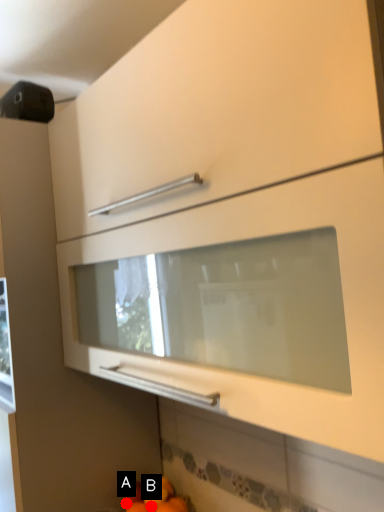
Question: Two points are circled on the image, labeled by A and B beside each circle. Which point is farther from the camera taking this photo?

Choices:
 (A) A is further
 (B) B is further

Answer: (A)